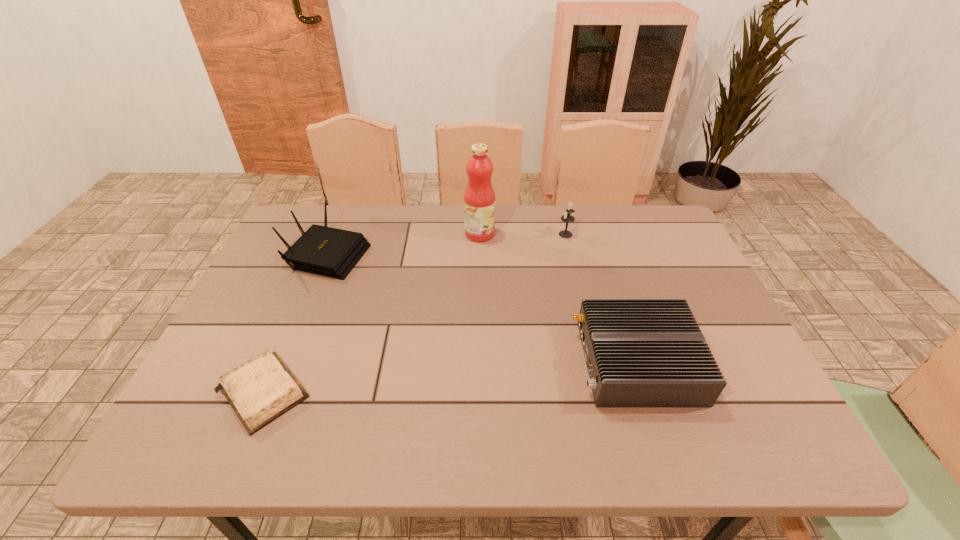
Find the location of a particular element. The height and width of the screenshot is (540, 960). fruit juice is located at coordinates (479, 198).

Where is `the tallest object`? The width and height of the screenshot is (960, 540). the tallest object is located at coordinates (479, 198).

You are a GUI agent. You are given a task and a screenshot of the screen. Output one action in this format:
    pyautogui.click(x=<x>, y=<y>)
    Task: Click on the candle holder
    
    Given the screenshot: What is the action you would take?
    pyautogui.click(x=567, y=218)

Where is `the left router`? The width and height of the screenshot is (960, 540). the left router is located at coordinates (321, 250).

You are a GUI agent. You are given a task and a screenshot of the screen. Output one action in this format:
    pyautogui.click(x=<x>, y=<y>)
    Task: Click on the fourth tallest object
    The image size is (960, 540).
    Given the screenshot: What is the action you would take?
    pyautogui.click(x=639, y=352)

This screenshot has width=960, height=540. I want to click on the nearer router, so click(639, 352).

Find the location of a particular element. diary is located at coordinates (260, 390).

Where is `free region located on the front label of the third object from left to right`? Image resolution: width=960 pixels, height=540 pixels. free region located on the front label of the third object from left to right is located at coordinates pos(593,234).

Where is `vacant space located on the right of the candle holder`? vacant space located on the right of the candle holder is located at coordinates (671, 234).

The height and width of the screenshot is (540, 960). Find the location of `vacant point located on the front of the farther router`. vacant point located on the front of the farther router is located at coordinates 288,347.